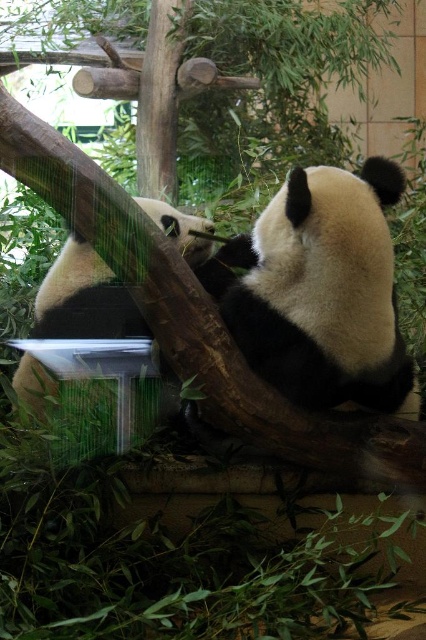
Question: Which of the following is the farthest from the observer?

Choices:
 (A) [x=20, y=380]
 (B) [x=397, y=182]

Answer: (A)

Question: Is black matte panda at center positioned at the back of black and white fur panda at center?

Choices:
 (A) no
 (B) yes

Answer: (B)

Question: Does black matte panda at center have a lesser width compared to black and white fur panda at center?

Choices:
 (A) yes
 (B) no

Answer: (B)

Question: Which point is closer to the camera taking this photo?

Choices:
 (A) (201, 275)
 (B) (319, 380)

Answer: (B)

Question: Does black matte panda at center appear over black and white fur panda at center?

Choices:
 (A) yes
 (B) no

Answer: (A)